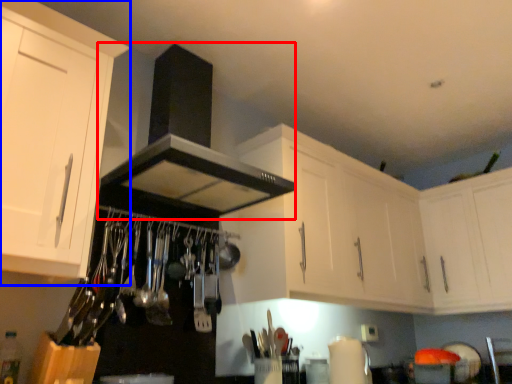
Question: Which object appears closest to the camera in this image, exhaust hood (highlighted by a red box) or cabinetry (highlighted by a blue box)?

Choices:
 (A) exhaust hood
 (B) cabinetry

Answer: (B)